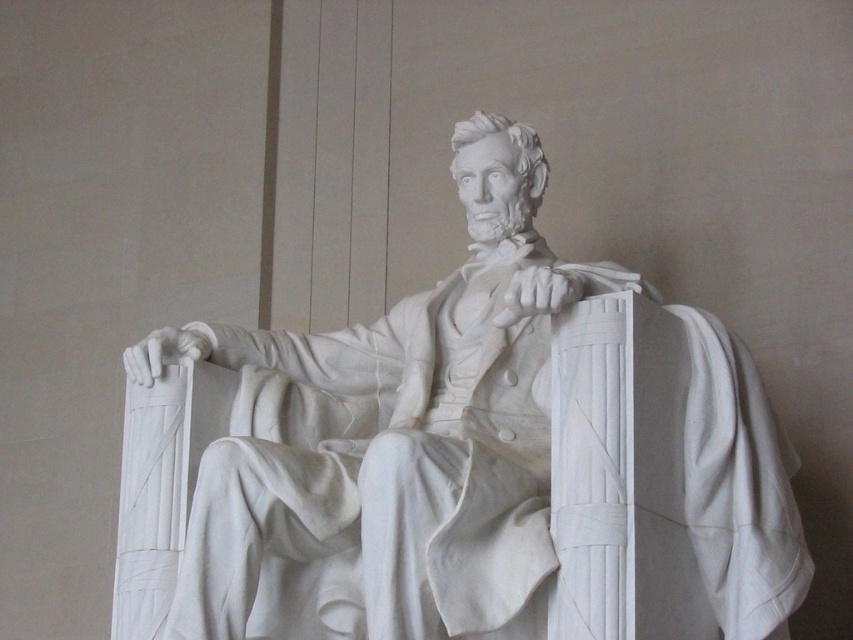
You are an art conservator examining the statue of Abraham Lincoln. You notice the white marble statue at center and the white marble book at center. Which object is placed above the other?

The white marble statue at center is positioned over the white marble book at center, meaning the statue is above the book.

You are an art conservator examining the statue and book. You need to place a protective cover over both items. Since the white marble statue at center is on the left of the white marble book at center, which item should you cover first to ensure the cover doesn

The white marble statue at center is positioned on the left side of the white marble book at center, so you should cover the white marble statue at center first to ensure the cover properly covers both items without shifting.